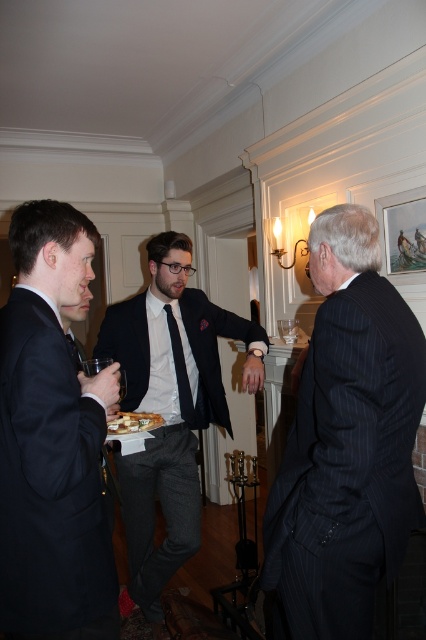
You are standing in the room and want to locate the black silk tie at center. Please provide its coordinates in the image.

The black silk tie at center is located at coordinates point (x=180, y=369).

You are at a formal event and notice two gentlemen in the center of the scene. One is wearing a pinstriped suit at center and the other has a black silk tie at center. From your perspective, which gentleman is positioned to the right?

The pinstriped suit at center is positioned to the right of the black silk tie at center.

You are planning to take a photo of the matte black suit at center and the white glossy plate at center. Which object should you focus on first if you want to capture both in the frame without moving the camera?

The matte black suit at center has a larger size compared to the white glossy plate at center, so you should focus on the matte black suit at center first to ensure it fits properly in the frame.